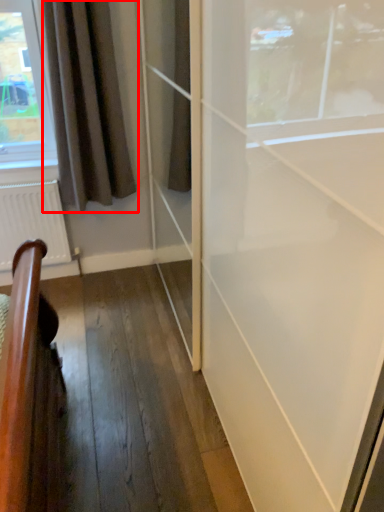
Question: From the image's perspective, what is the correct spatial relationship of curtain (annotated by the red box) in relation to radiator?

Choices:
 (A) above
 (B) below

Answer: (A)